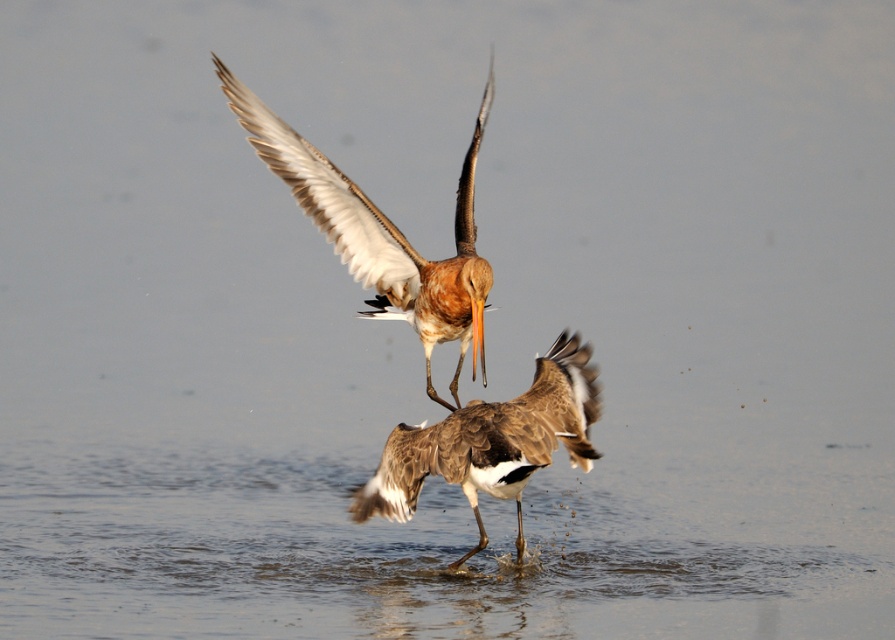
You are a wildlife photographer aiming to capture a closeup shot of the brown feathered bird at center. Your camera has a minimum focusing distance of 5 meters. Can you take the photo without moving closer?

The brown feathered bird at center and camera are 5.29 meters apart from each other. Since the minimum focusing distance is 5 meters, the camera can focus on the bird as it is within range. Therefore, you can take the photo without moving closer.

You are a birdwatcher observing two birds in the center of a lake. You notice a brown feathered bird at center and a brown speckled feathers at center. Which bird is located to the left?

The brown feathered bird at center is positioned on the left side of brown speckled feathers at center.